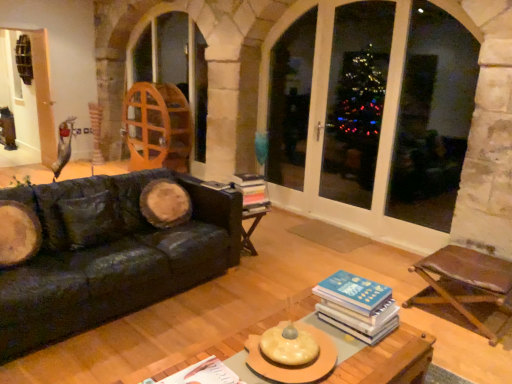
Find the location of `free space on the front side of brown leather chair at lower right`. free space on the front side of brown leather chair at lower right is located at coordinates (471, 356).